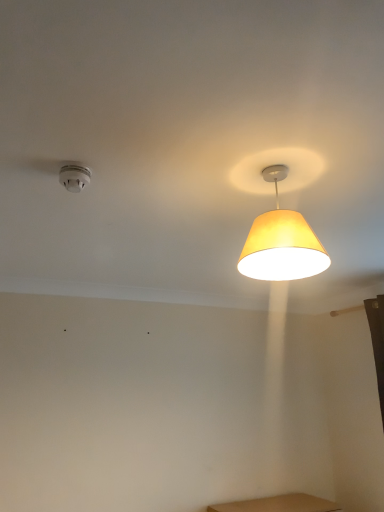
This screenshot has width=384, height=512. I want to click on white plastic smoke detector at upper left, so click(74, 177).

Image resolution: width=384 pixels, height=512 pixels. What do you see at coordinates (74, 177) in the screenshot? I see `white plastic smoke detector at upper left` at bounding box center [74, 177].

Measure the distance between white plastic smoke detector at upper left and camera.

4.48 feet.

Where is `white plastic smoke detector at upper left`? Image resolution: width=384 pixels, height=512 pixels. white plastic smoke detector at upper left is located at coordinates (74, 177).